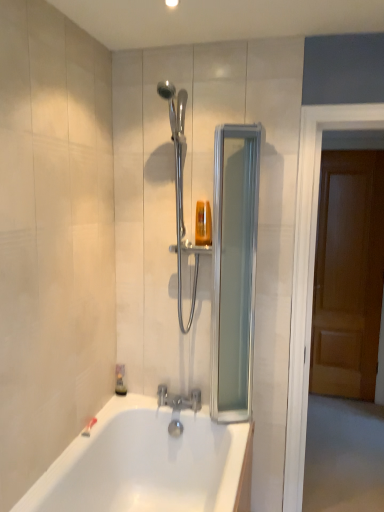
Question: From their relative heights in the image, would you say translucent plastic soap dispenser at lower left is taller or shorter than translucent plastic soap dispenser at upper center?

Choices:
 (A) tall
 (B) short

Answer: (B)

Question: From a real-world perspective, is translucent plastic soap dispenser at lower left physically located above or below translucent plastic soap dispenser at upper center?

Choices:
 (A) below
 (B) above

Answer: (A)

Question: Which object is the closest to the brown wooden door at right?

Choices:
 (A) silver metallic faucet at lower center
 (B) translucent plastic soap dispenser at upper center
 (C) clear glass screen door at upper center, which is the 2th screen door in right-to-left order
 (D) wooden door at right, the second screen door in the left-to-right sequence
 (E) translucent plastic soap dispenser at lower left

Answer: (D)

Question: Which object is positioned farthest from the translucent plastic soap dispenser at lower left?

Choices:
 (A) wooden door at right, the second screen door in the left-to-right sequence
 (B) brown wooden door at right
 (C) silver metallic faucet at lower center
 (D) translucent plastic soap dispenser at upper center
 (E) clear glass screen door at upper center, which ranks as the 1th screen door in left-to-right order

Answer: (B)